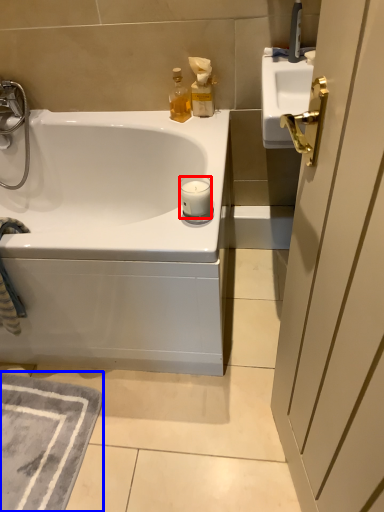
Question: Which object is closer to the camera taking this photo, candle (highlighted by a red box) or bath mat (highlighted by a blue box)?

Choices:
 (A) candle
 (B) bath mat

Answer: (A)